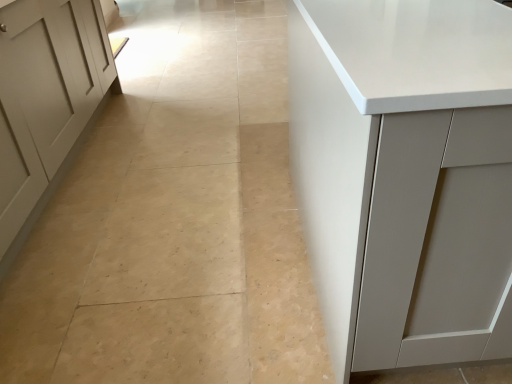
This screenshot has height=384, width=512. Describe the element at coordinates (391, 159) in the screenshot. I see `white matte cabinet at right` at that location.

Identify the location of white matte cabinet at right. This screenshot has height=384, width=512. (391, 159).

Identify the location of white matte cabinet at right. This screenshot has height=384, width=512. (391, 159).